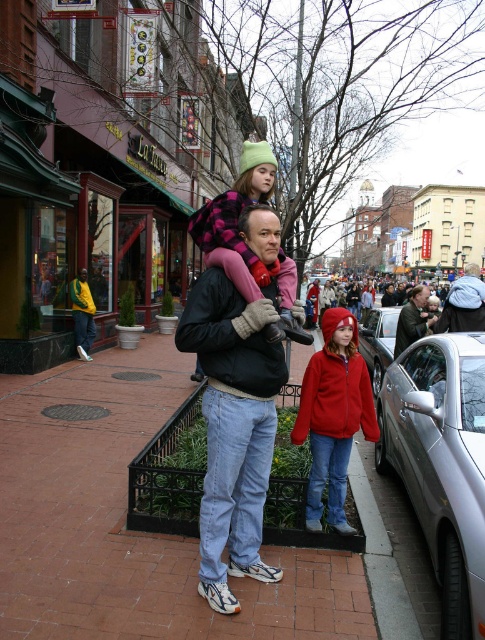
You are a delivery person who needs to place a package on the brick pavement at center. The package has a weight limit of 100 kg. Can you safely place it there?

The brick pavement at center is located at point (125,522), but the weight limit is not provided in the description. Therefore, it is impossible to determine if the package can be safely placed there based on the given information.

You are a photographer trying to capture a photo of the silver metallic car at center without including the plush pink coat at center in the frame. Based on their positions, is this possible?

The plush pink coat at center is to the left of the silver metallic car at center, so if you position yourself to the right side of the car, you can capture the car without the coat in the frame.

You are a delivery person who needs to deliver a package to a recipient wearing a plush pink coat at center. The package can only be handed over to someone within 2 meters of a silver metallic car at center. Based on the scene, can you confirm if the recipient is within the required distance?

The plush pink coat at center is less in width than the silver metallic car at center, but the exact distance between them isn not specified. Therefore, it is uncertain whether the recipient is within the 2 meter requirement. Please check the actual distance before proceeding.